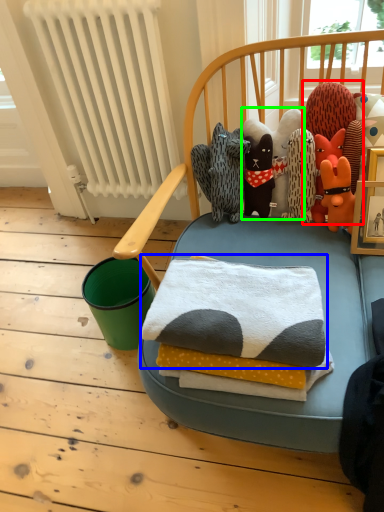
Question: Based on their relative distances, which object is nearer to toy (highlighted by a red box)? Choose from bath towel (highlighted by a blue box) and toy (highlighted by a green box).

Choices:
 (A) bath towel
 (B) toy

Answer: (B)